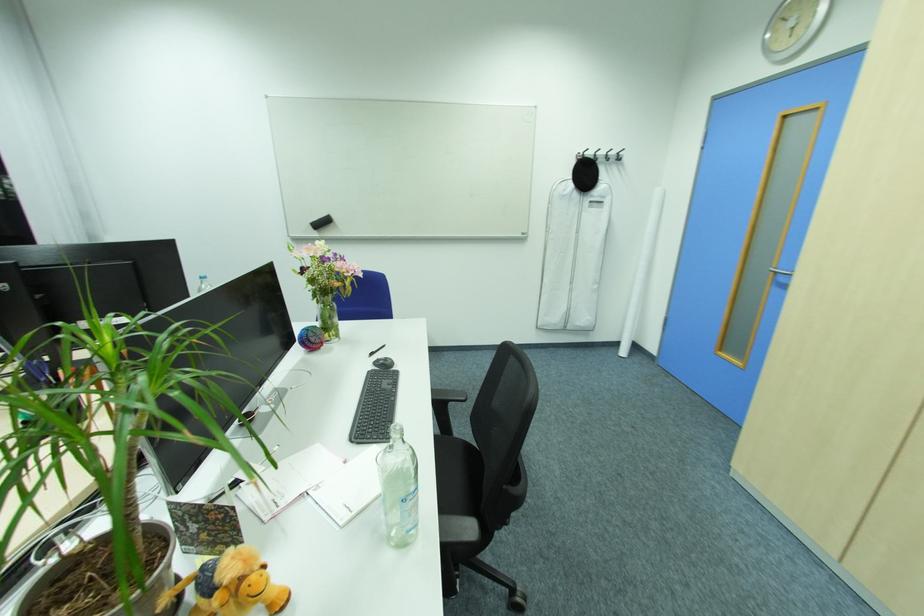
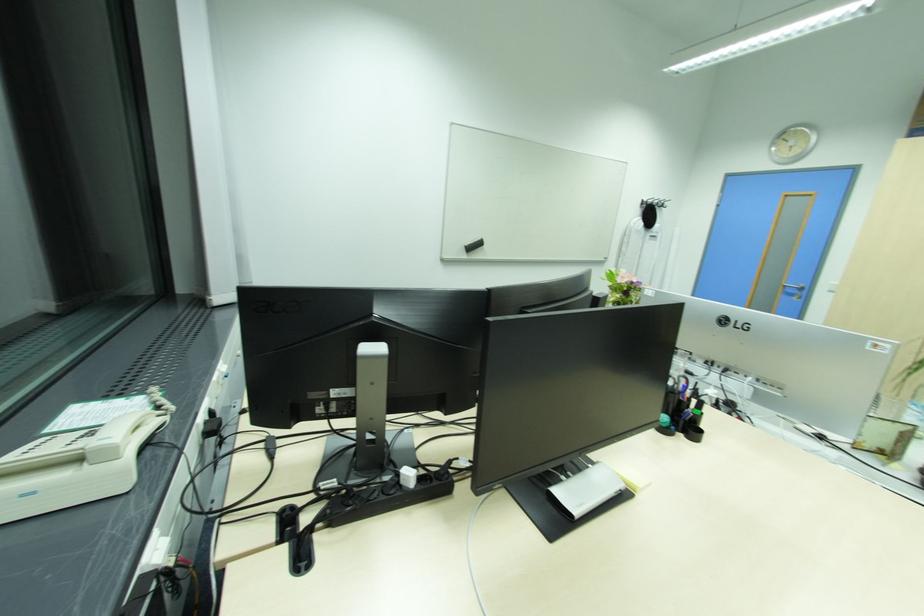
Locate, in the second image, the point that corresponds to point (772, 37) in the first image.

(779, 148)